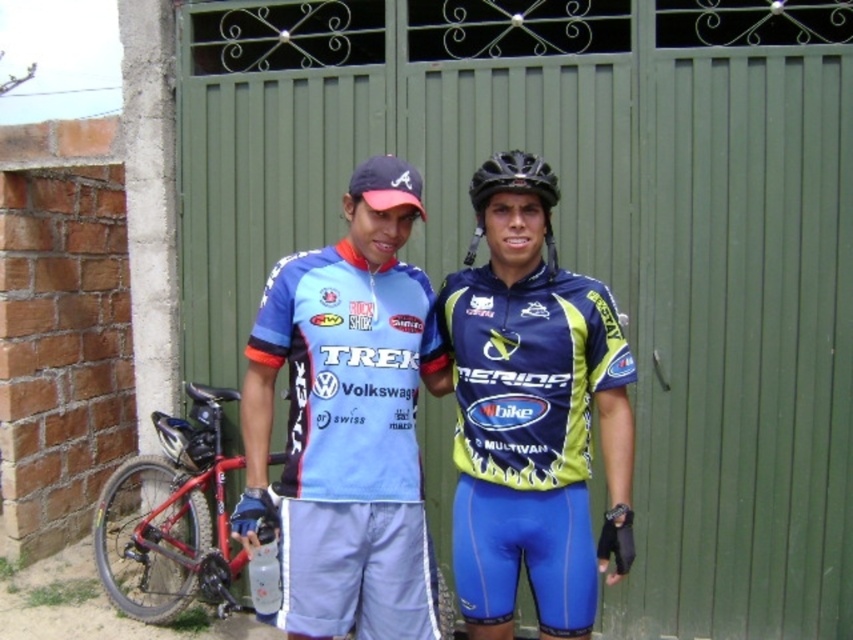
How distant is matte blue jersey at center from black matte bicycle helmet at center?

The distance of matte blue jersey at center from black matte bicycle helmet at center is 26.73 inches.

Which is behind, point (396, 298) or point (482, 179)?

The point (396, 298) is more distant.

Where is `matte blue jersey at center`? The image size is (853, 640). matte blue jersey at center is located at coordinates (350, 442).

Who is more forward, (627, 561) or (457, 342)?

Point (627, 561) is in front.

Is blue jersey at center positioned behind blue/neon green jersey at center?

No, it is in front of blue/neon green jersey at center.

Who is more distant from viewer, (456, 556) or (561, 512)?

The point (456, 556) is behind.

What are the coordinates of `blue jersey at center` in the screenshot? It's located at (532, 426).

Is red matte bicycle at lower left taller than black matte bicycle helmet at center?

Yes, red matte bicycle at lower left is taller than black matte bicycle helmet at center.

From the picture: Which of these two, red matte bicycle at lower left or black matte bicycle helmet at center, stands shorter?

With less height is black matte bicycle helmet at center.

Where is `red matte bicycle at lower left`? red matte bicycle at lower left is located at coordinates (170, 518).

This screenshot has height=640, width=853. Identify the location of red matte bicycle at lower left. (170, 518).